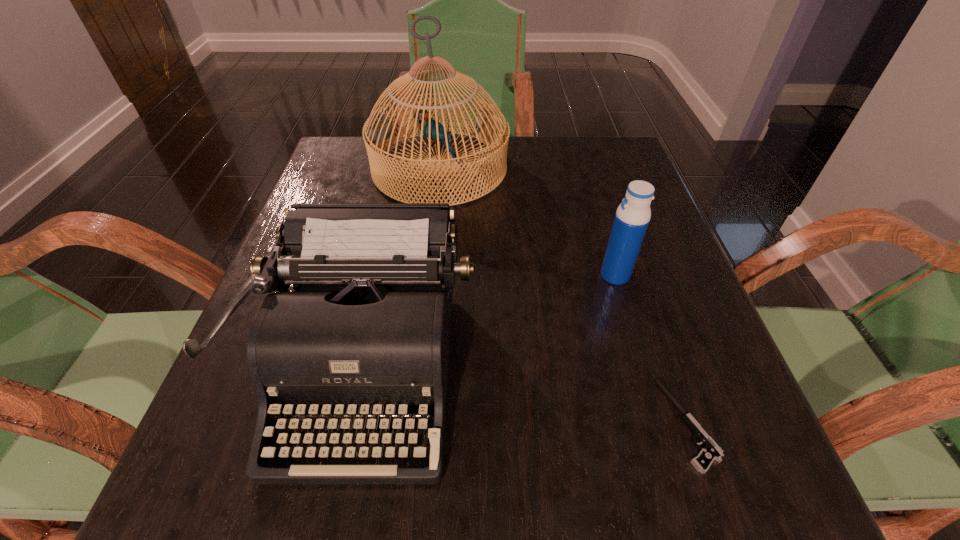
This screenshot has height=540, width=960. I want to click on vacant area at the far edge, so click(x=544, y=154).

Locate an element on the screen. Image resolution: width=960 pixels, height=540 pixels. blank area at the near edge is located at coordinates (345, 518).

You are a GUI agent. You are given a task and a screenshot of the screen. Output one action in this format:
    pyautogui.click(x=<x>, y=<y>)
    Task: Click on the blank space at the left edge
    The width and height of the screenshot is (960, 540).
    Given the screenshot: What is the action you would take?
    pyautogui.click(x=214, y=435)

Find the location of a particular element. vacant point at the right edge is located at coordinates (646, 331).

At what (x,y) coordinates should I click in order to perform the action: click on vacant region at the far left corner of the desktop. Please return your answer as a coordinate pair (x, y). Image resolution: width=960 pixels, height=540 pixels. Looking at the image, I should click on (339, 150).

The image size is (960, 540). Find the location of `vacant space at the near left corner`. vacant space at the near left corner is located at coordinates (206, 505).

The width and height of the screenshot is (960, 540). What are the coordinates of `vacant point located between the birdcage and the pistol` in the screenshot? It's located at (564, 296).

Where is `free space that is in between the birdcage and the pistol`? This screenshot has width=960, height=540. free space that is in between the birdcage and the pistol is located at coordinates (564, 296).

Locate an element on the screen. This screenshot has width=960, height=540. free space between the water bottle and the birdcage is located at coordinates (527, 221).

Identify the location of free space between the pistol and the birdcage. This screenshot has height=540, width=960. (564, 296).